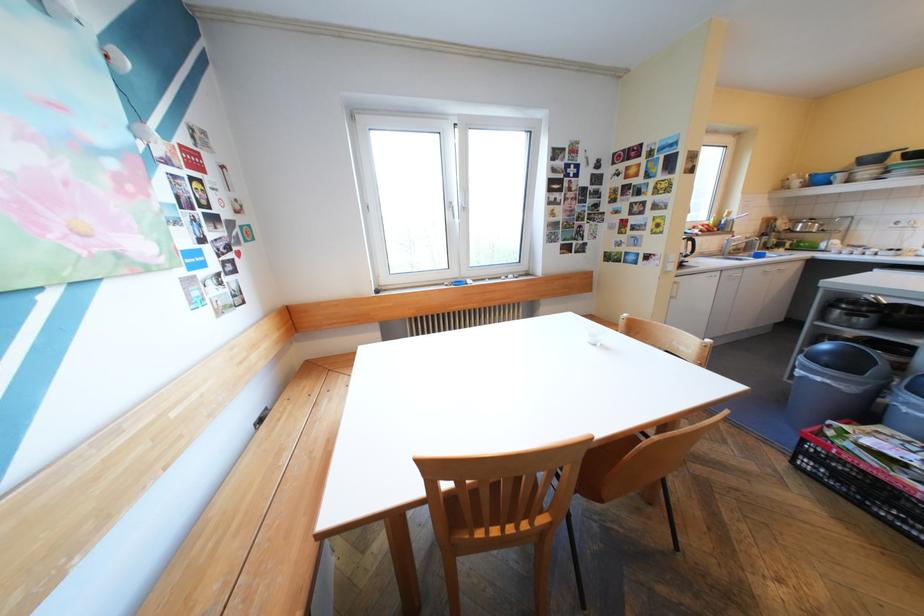
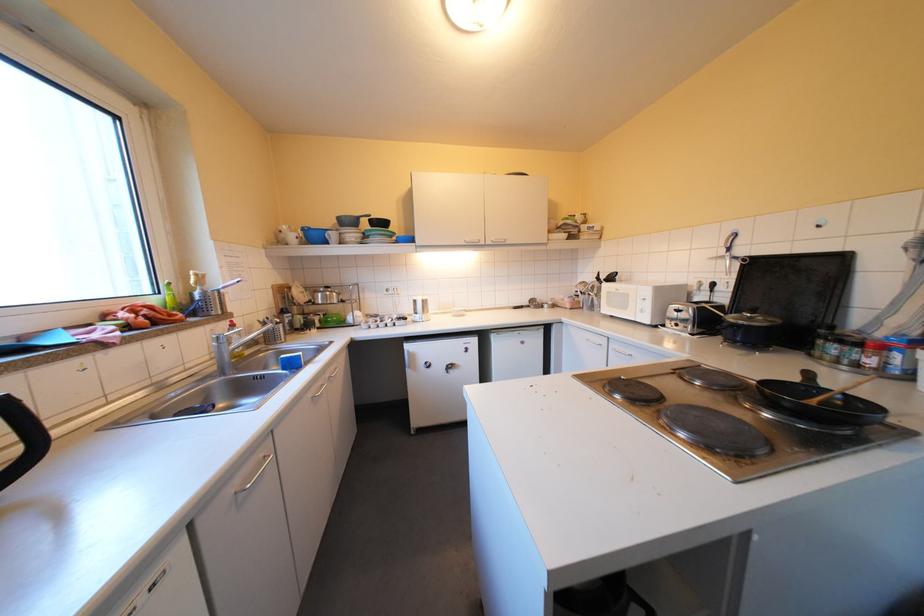
Find the pixel in the second image that matches point (809, 182) in the first image.

(305, 236)